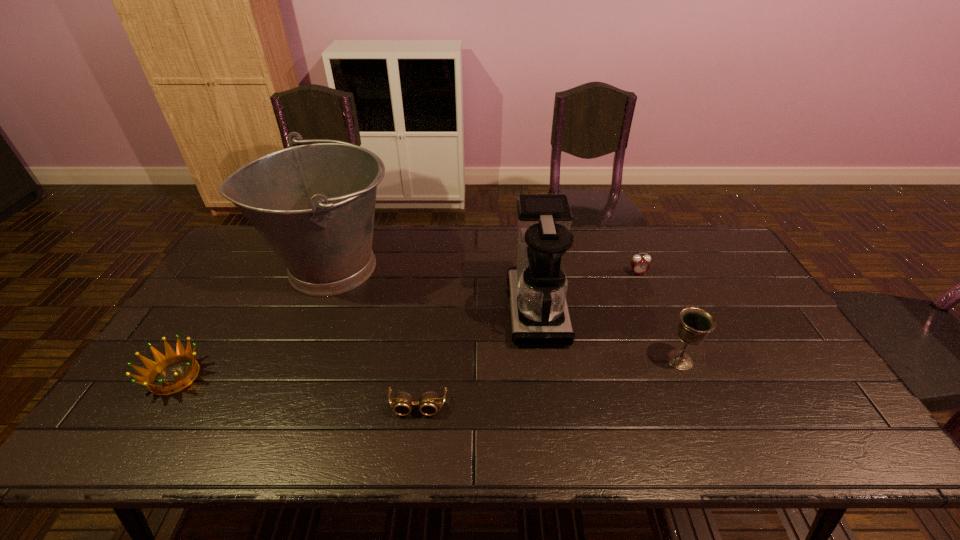
In the image, there is a desktop. Where is `free space at the far edge`? The image size is (960, 540). free space at the far edge is located at coordinates (503, 252).

Locate an element on the screen. This screenshot has height=540, width=960. free spot at the near edge of the desktop is located at coordinates (589, 448).

Where is `vacant space at the left edge of the desktop`? This screenshot has height=540, width=960. vacant space at the left edge of the desktop is located at coordinates (233, 316).

In the image, there is a desktop. Where is `vacant space at the right edge`? The height and width of the screenshot is (540, 960). vacant space at the right edge is located at coordinates (718, 276).

Image resolution: width=960 pixels, height=540 pixels. In order to click on vacant space at the far right corner of the desktop in this screenshot , I will do `click(696, 227)`.

Locate an element on the screen. This screenshot has width=960, height=540. free space between the alarm clock and the tallest object is located at coordinates (485, 270).

Where is `free spot between the shortest object and the second tallest object`? free spot between the shortest object and the second tallest object is located at coordinates click(477, 358).

I want to click on vacant area that lies between the third tallest object and the tallest object, so click(x=506, y=313).

Locate an element on the screen. free space between the second tallest object and the third object from left to right is located at coordinates (477, 358).

Where is `free space between the third tallest object and the crown`? This screenshot has width=960, height=540. free space between the third tallest object and the crown is located at coordinates (427, 368).